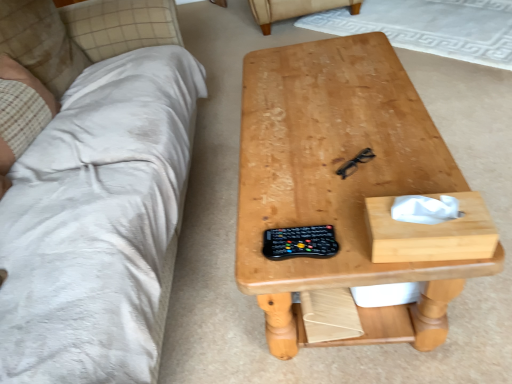
This screenshot has height=384, width=512. Find the location of `free location to the right of black plastic remote at center`. free location to the right of black plastic remote at center is located at coordinates pyautogui.click(x=360, y=236).